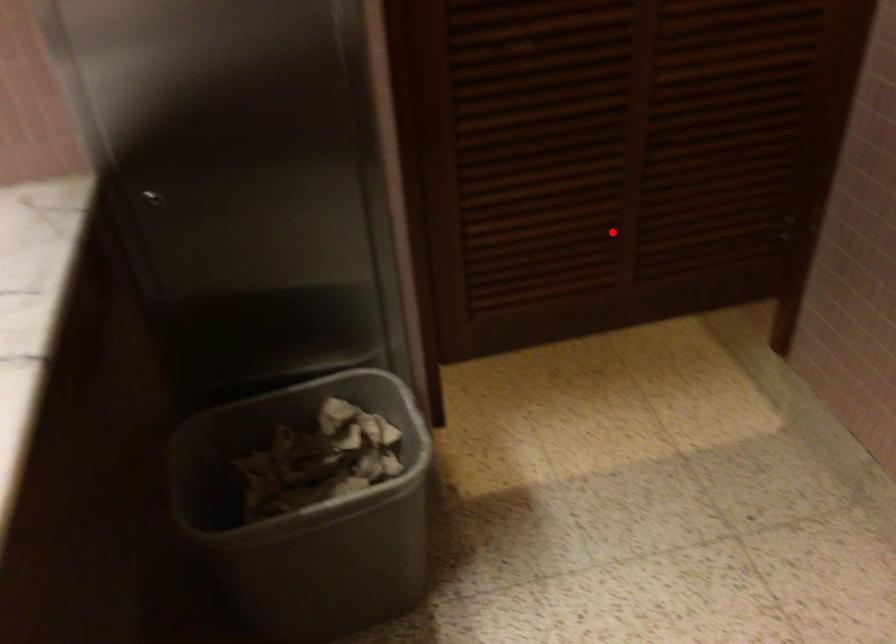
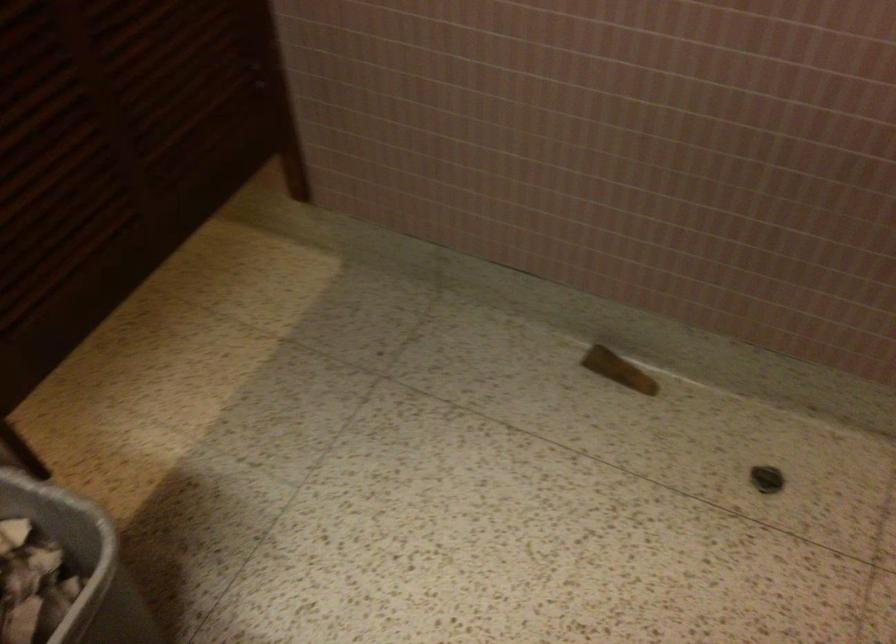
Question: I am providing you with two images of the same scene from different viewpoints. Image1 has a red point marked. In image2, the corresponding 3D location appears at what relative position? Reply with the corresponding letter.

Choices:
 (A) Closer
 (B) Farther

Answer: (A)